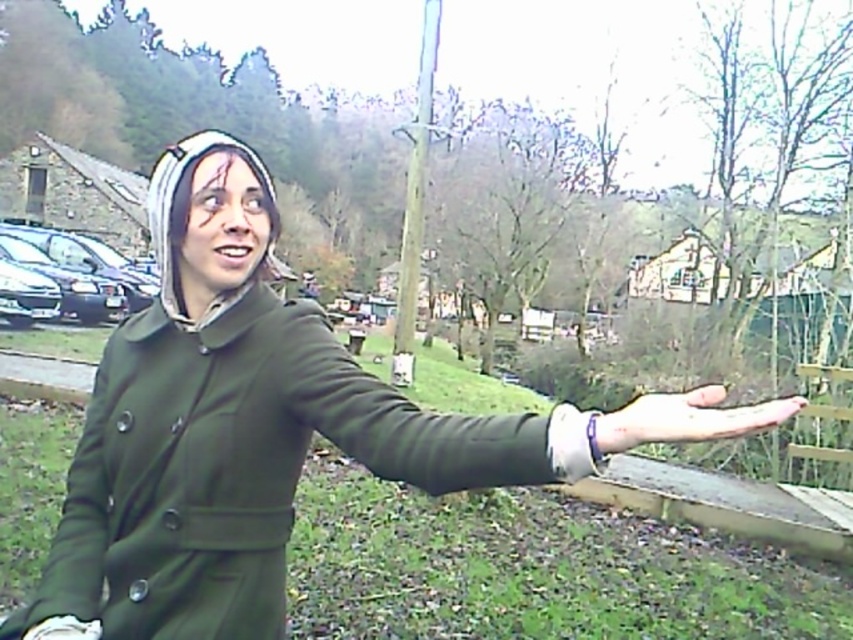
Based on the photo, who is positioned more to the right, green fabric arm at center or smooth skin hand at center?

From the viewer's perspective, smooth skin hand at center appears more on the right side.

The image size is (853, 640). In order to click on green fabric arm at center in this screenshot , I will do point(485,428).

Who is more forward, (436,483) or (741,424)?

Positioned in front is point (741,424).

Locate an element on the screen. green fabric arm at center is located at coordinates (485, 428).

Is point (180, 445) farther from viewer compared to point (627, 436)?

Yes, point (180, 445) is behind point (627, 436).

Does green matte jacket at center appear on the left side of smooth skin hand at center?

Yes, green matte jacket at center is to the left of smooth skin hand at center.

Describe the element at coordinates (235, 467) in the screenshot. I see `green matte jacket at center` at that location.

Locate an element on the screen. The height and width of the screenshot is (640, 853). green matte jacket at center is located at coordinates (235, 467).

How distant is green matte jacket at center from green fabric arm at center?

green matte jacket at center and green fabric arm at center are 9.86 inches apart from each other.

This screenshot has width=853, height=640. Describe the element at coordinates (235, 467) in the screenshot. I see `green matte jacket at center` at that location.

This screenshot has height=640, width=853. Identify the location of green matte jacket at center. (235, 467).